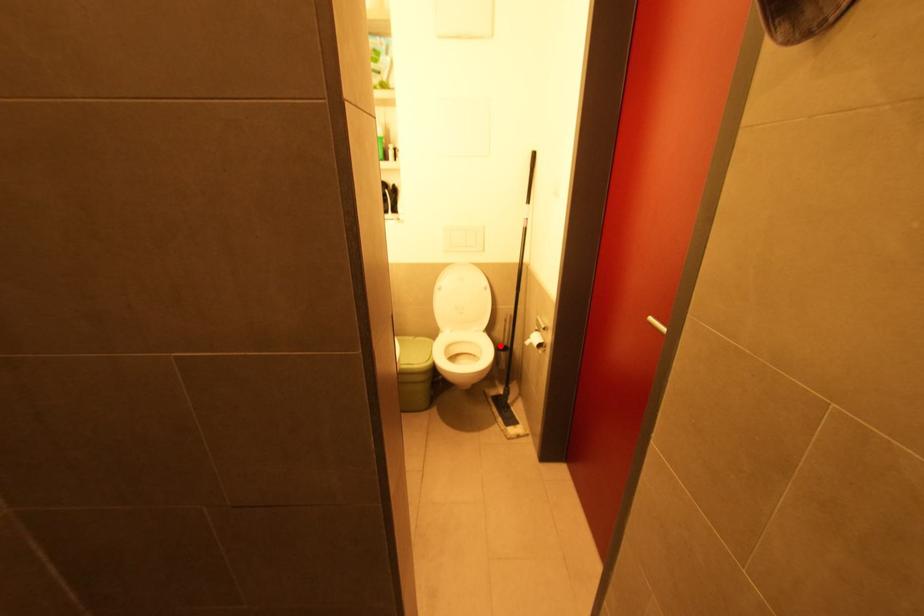
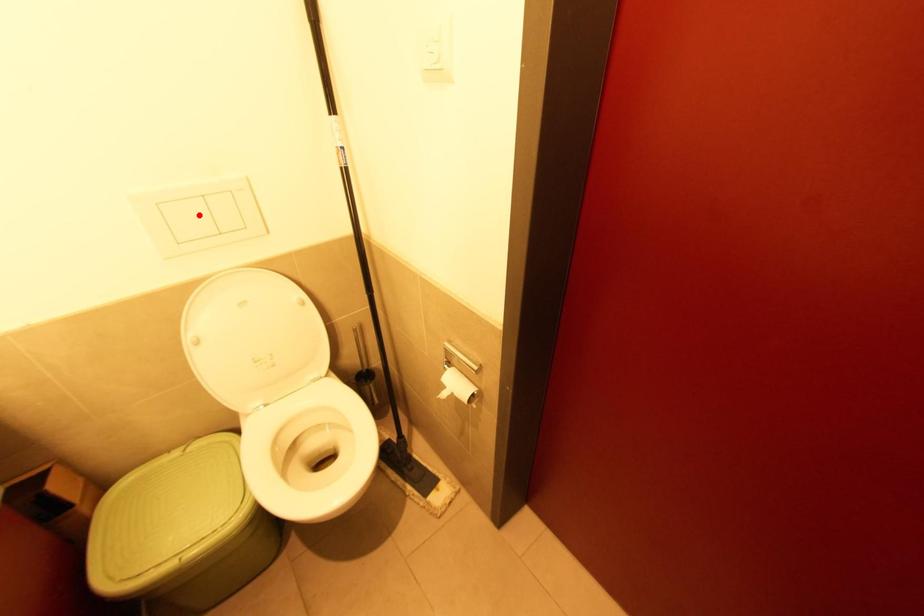
I am providing you with two images of the same scene from different viewpoints. A red point is marked on the first image and another point is marked on the second image. Does the point marked in image1 correspond to the same location as the one in image2?

No